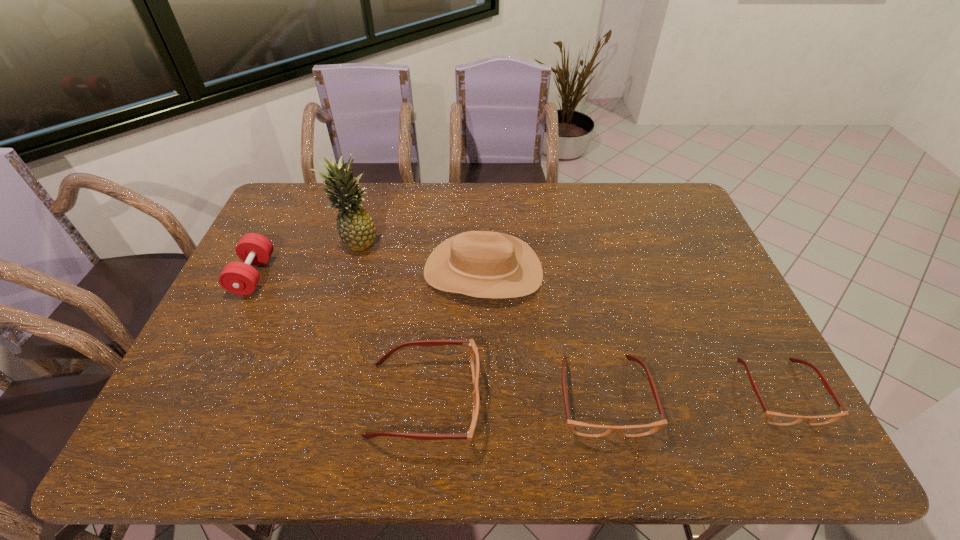
What are the coordinates of `free region at the right edge of the desktop` in the screenshot? It's located at (715, 363).

I want to click on vacant space at the near left corner of the desktop, so click(169, 406).

You are a GUI agent. You are given a task and a screenshot of the screen. Output one action in this format:
    pyautogui.click(x=<x>, y=<y>)
    Task: Click on the free spot between the second shortest spectacles and the tallest object
    This screenshot has height=540, width=960.
    Given the screenshot: What is the action you would take?
    pyautogui.click(x=481, y=318)

Find the location of a particular element. The image size is (960, 540). empty space that is in between the dumbbell and the rightmost object is located at coordinates (516, 334).

Where is `free space between the second shortest spectacles and the leftmost object`? This screenshot has width=960, height=540. free space between the second shortest spectacles and the leftmost object is located at coordinates (428, 335).

In order to click on vacant area between the second object from left to right and the leftmost spectacles in this screenshot , I will do `click(391, 320)`.

In order to click on empty location between the second spectacles from right to left and the pineapple in this screenshot , I will do `click(481, 318)`.

Find the location of a particular element. blank region between the fourth shortest object and the pineapple is located at coordinates click(x=305, y=258).

The height and width of the screenshot is (540, 960). Identify the location of free area in between the pineapple and the cowboy hat. (420, 256).

This screenshot has width=960, height=540. What are the coordinates of `vacant region between the second tallest spectacles and the leftmost spectacles` in the screenshot? It's located at (514, 397).